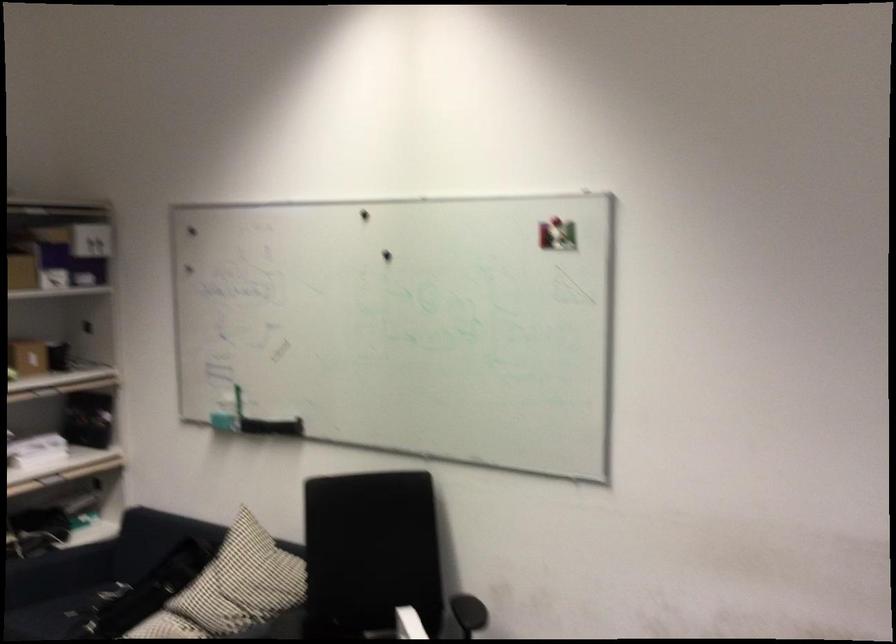
Describe the element at coordinates (59, 614) in the screenshot. The height and width of the screenshot is (644, 896). I see `the sofa sitting surface` at that location.